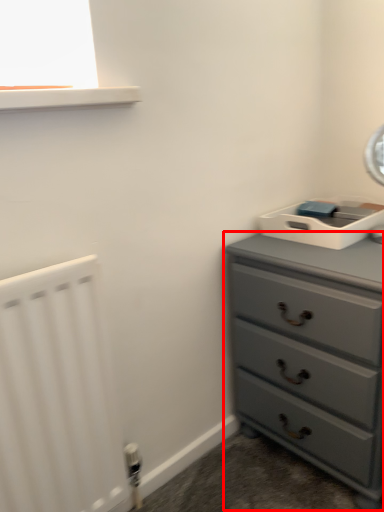
Question: Where is chest of drawers (annotated by the red box) located in relation to radiator in the image?

Choices:
 (A) left
 (B) right

Answer: (B)